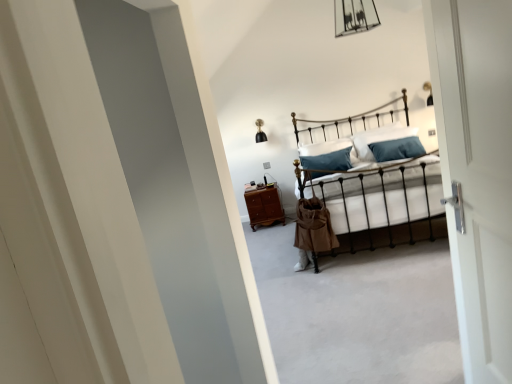
Question: From the image's perspective, is brown wooden nightstand at center located above or below metallic iron bed at center?

Choices:
 (A) above
 (B) below

Answer: (B)

Question: Looking at their shapes, would you say brown wooden nightstand at center is wider or thinner than metallic iron bed at center?

Choices:
 (A) thin
 (B) wide

Answer: (A)

Question: Based on their relative distances, which object is farther from the brown wooden nightstand at center?

Choices:
 (A) white soft pillow at center, acting as the 2th pillow starting from the left
 (B) metallic iron bed at center
 (C) white soft pillow at center, which is counted as the second pillow, starting from the right

Answer: (A)

Question: Considering the real-world distances, which object is farthest from the white soft pillow at center, which is counted as the second pillow, starting from the right?

Choices:
 (A) brown wooden nightstand at center
 (B) white soft pillow at center, acting as the 2th pillow starting from the left
 (C) metallic iron bed at center

Answer: (B)